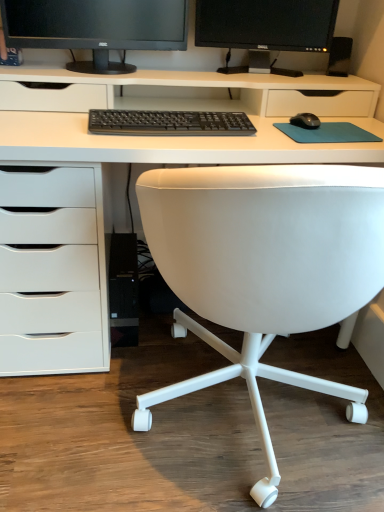
Locate an element on the screen. free space that is to the left of black plastic speaker at upper right is located at coordinates (306, 73).